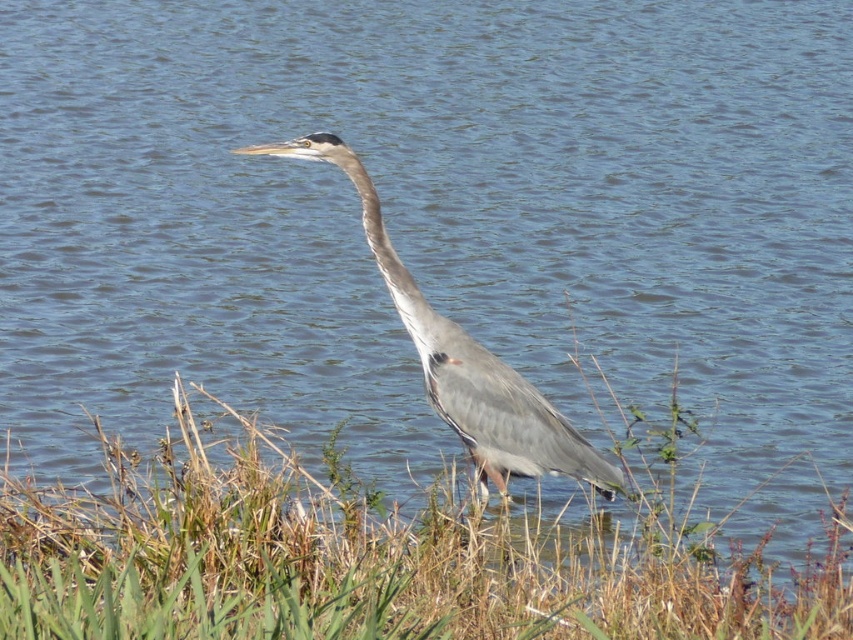
You are a photographer trying to capture the Great Blue Heron in the image. You want to ensure that the green grass at lower center at point (370, 560) is visible in the background. Is the heron positioned in a way that allows this?

The green grass at lower center at point (370, 560) is located behind the Great Blue Heron. Since the heron is facing towards the right and positioned off to the left side of the frame, the photographer can position themselves so that the heron is centered while the green grass at lower center at point (370, 560) remains visible in the background.

You are a photographer trying to capture the Great Blue Heron. You notice the green grass at lower center and the gray matte neck at center in your viewfinder. Which object is closer to the bottom edge of the photo?

The green grass at lower center is closer to the bottom edge of the photo because it is located below the gray matte neck at center.

You are a photographer trying to capture the Great Blue Heron in the image. You notice the green grass at lower center and the gray matte neck at center. Which object is positioned closer to your camera lens?

The green grass at lower center is closer to the viewer than the gray matte neck at center, so the green grass at lower center would be closer to the camera lens.